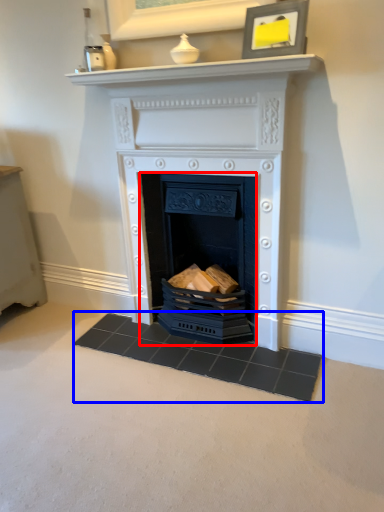
Question: Which object appears closest to the camera in this image, fireplace (highlighted by a red box) or doormat (highlighted by a blue box)?

Choices:
 (A) fireplace
 (B) doormat

Answer: (B)